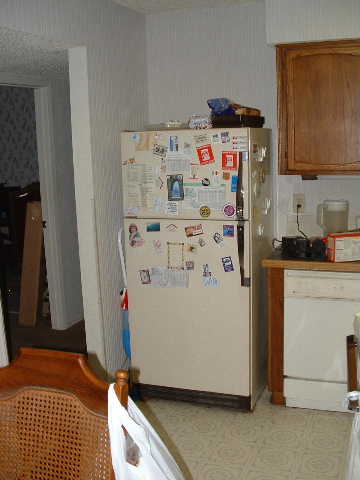
Where is `chrome refrigerator handle`? Image resolution: width=360 pixels, height=480 pixels. chrome refrigerator handle is located at coordinates (239, 238).